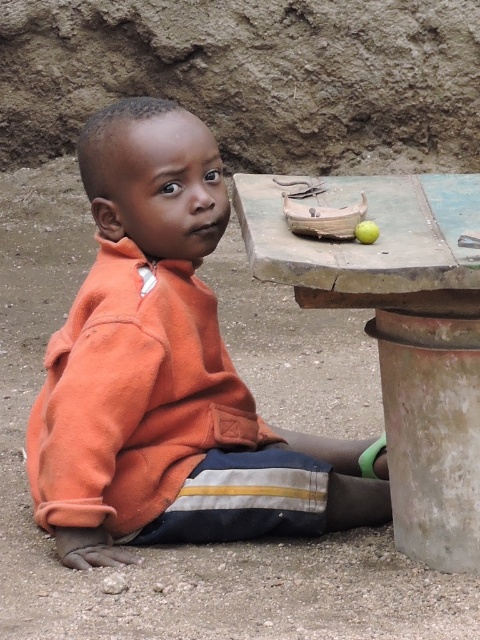
Question: Does blue painted wood picnic table at upper center have a lesser width compared to green matte apple at upper center?

Choices:
 (A) yes
 (B) no

Answer: (B)

Question: Does blue painted wood picnic table at upper center have a larger size compared to green matte apple at upper center?

Choices:
 (A) no
 (B) yes

Answer: (B)

Question: Can you confirm if orange fleece jacket at center is smaller than green matte apple at upper center?

Choices:
 (A) yes
 (B) no

Answer: (B)

Question: Which object appears closest to the camera in this image?

Choices:
 (A) blue painted wood picnic table at upper center
 (B) orange fleece jacket at center
 (C) green matte apple at upper center

Answer: (A)

Question: Which of the following is the closest to the observer?

Choices:
 (A) (394, 272)
 (B) (165, 269)

Answer: (A)

Question: Considering the real-world distances, which object is closest to the green matte apple at upper center?

Choices:
 (A) blue painted wood picnic table at upper center
 (B) orange fleece jacket at center

Answer: (A)